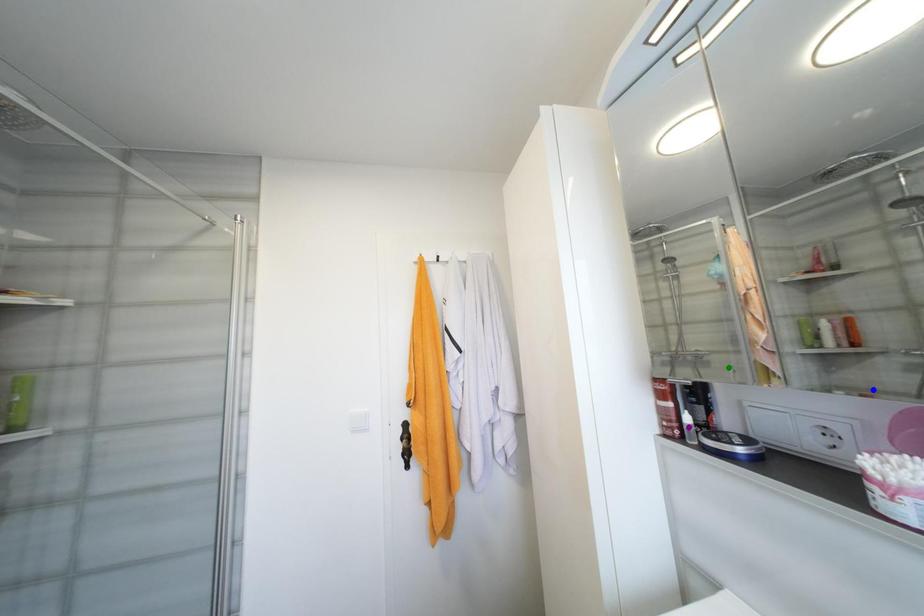
Order these from nearest to farthest:
green point
purple point
blue point

1. blue point
2. purple point
3. green point